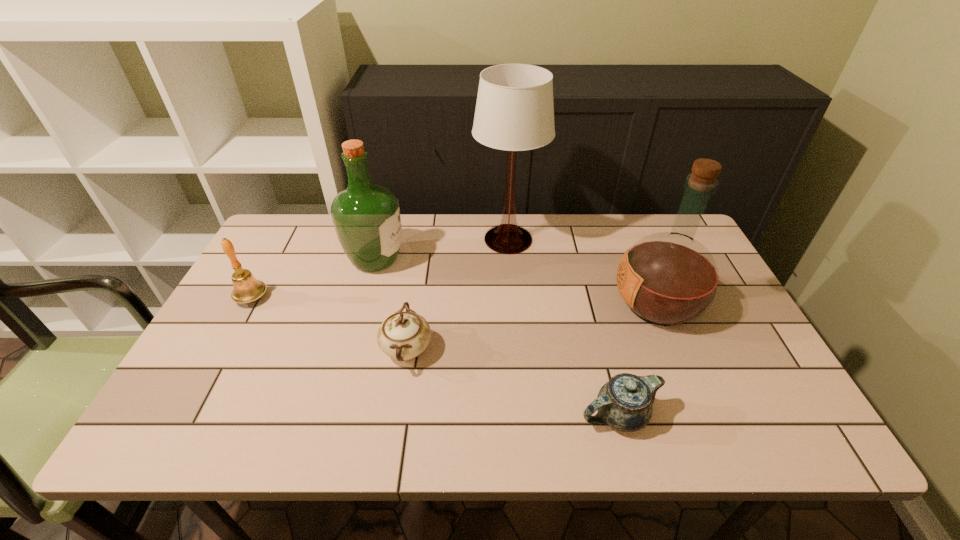
The image size is (960, 540). Find the location of `vacant space located 0.280m above the cylindrical shade of the table lamp`. vacant space located 0.280m above the cylindrical shade of the table lamp is located at coordinates (385, 239).

This screenshot has width=960, height=540. In order to click on blank space located 0.200m above the cylindrical shade of the table lamp in this screenshot , I will do `click(410, 239)`.

Locate an element on the screen. Image resolution: width=960 pixels, height=540 pixels. vacant area located 0.300m on the front label of the right liquor is located at coordinates (499, 304).

At what (x,y) coordinates should I click in order to perform the action: click on free region located 0.080m on the front label of the right liquor. Please return your answer as a coordinate pair (x, y). This screenshot has height=540, width=960. Looking at the image, I should click on (582, 304).

Locate an element on the screen. vacant position located 0.280m on the front label of the right liquor is located at coordinates click(507, 304).

This screenshot has height=540, width=960. Identify the location of blank space located 0.330m on the front-facing side of the left liquor. coord(516,259).

Find the location of a particular element. The height and width of the screenshot is (540, 960). vacant space located 0.090m on the back of the third shortest object is located at coordinates (269, 266).

What are the coordinates of `vacant space situated on the right of the farther chinaware` in the screenshot? It's located at (536, 349).

Where is `vacant space positioned from the spout of the nearer chinaware`? Image resolution: width=960 pixels, height=540 pixels. vacant space positioned from the spout of the nearer chinaware is located at coordinates (391, 415).

Where is `vacant area situated 0.230m from the spout of the nearer chinaware`? Image resolution: width=960 pixels, height=540 pixels. vacant area situated 0.230m from the spout of the nearer chinaware is located at coordinates coord(470,415).